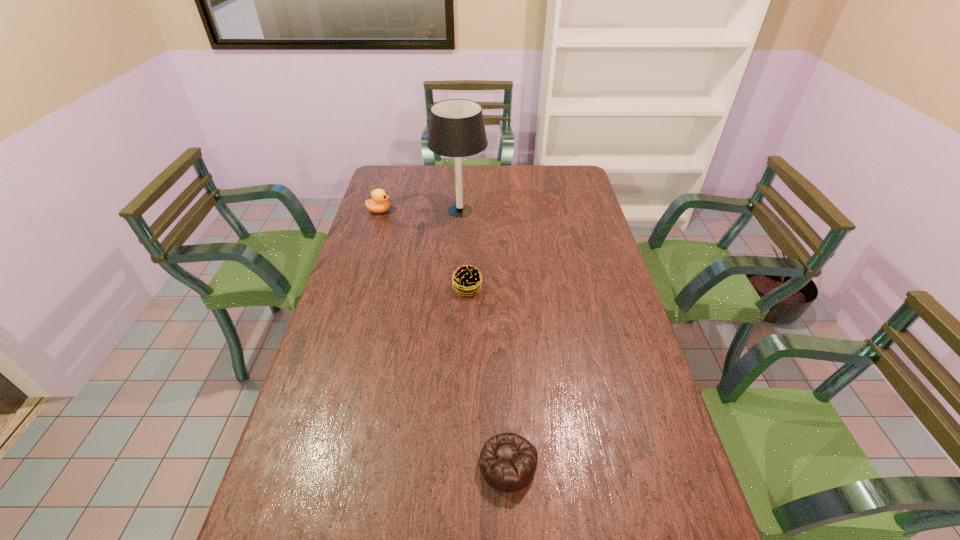
This screenshot has width=960, height=540. I want to click on free space that satisfies the following two spatial constraints: 1. on the back side of the shortest object; 2. on the face of the duckling, so click(495, 211).

The height and width of the screenshot is (540, 960). Identify the location of vacant space that satisfies the following two spatial constraints: 1. on the face of the leftmost object; 2. on the right side of the third tallest object. (356, 288).

Where is `free spot that satisfies the following two spatial constraints: 1. on the front side of the third tallest object; 2. on the right side of the beanbag`? free spot that satisfies the following two spatial constraints: 1. on the front side of the third tallest object; 2. on the right side of the beanbag is located at coordinates (462, 464).

Where is `free space in the image that satisfies the following two spatial constraints: 1. on the face of the second tallest object; 2. on the back side of the third farthest object`? free space in the image that satisfies the following two spatial constraints: 1. on the face of the second tallest object; 2. on the back side of the third farthest object is located at coordinates (356, 288).

You are a GUI agent. You are given a task and a screenshot of the screen. Output one action in this format:
    pyautogui.click(x=<x>, y=<y>)
    Task: Click on the vacant space that satisfies the following two spatial constraints: 1. on the front side of the table lamp; 2. on the face of the leftmost object
    
    Given the screenshot: What is the action you would take?
    pyautogui.click(x=460, y=211)

I want to click on vacant space that satisfies the following two spatial constraints: 1. on the face of the leftmost object; 2. on the right side of the shortest object, so click(302, 464).

Locate an element on the screen. free space that satisfies the following two spatial constraints: 1. on the front side of the tallest object; 2. on the right side of the beanbag is located at coordinates (444, 464).